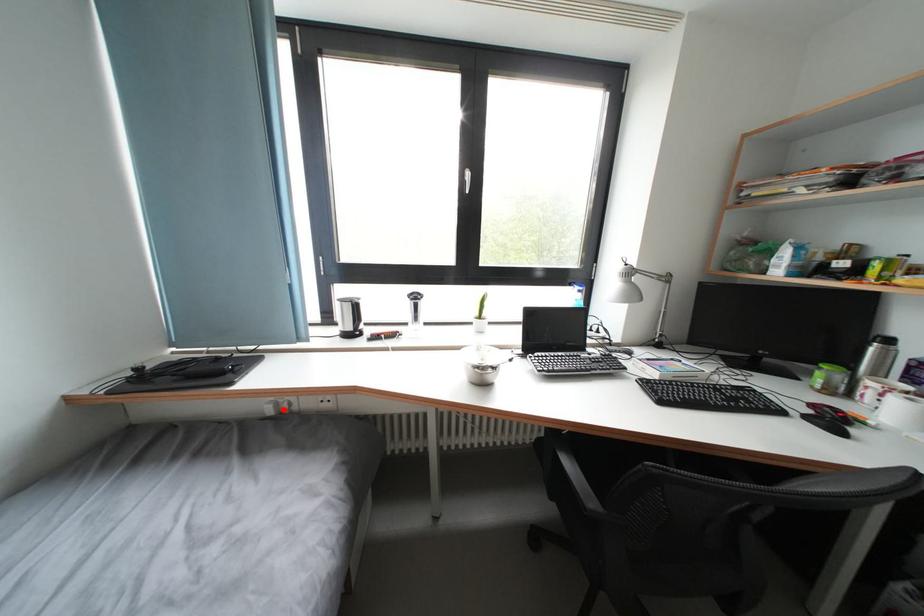
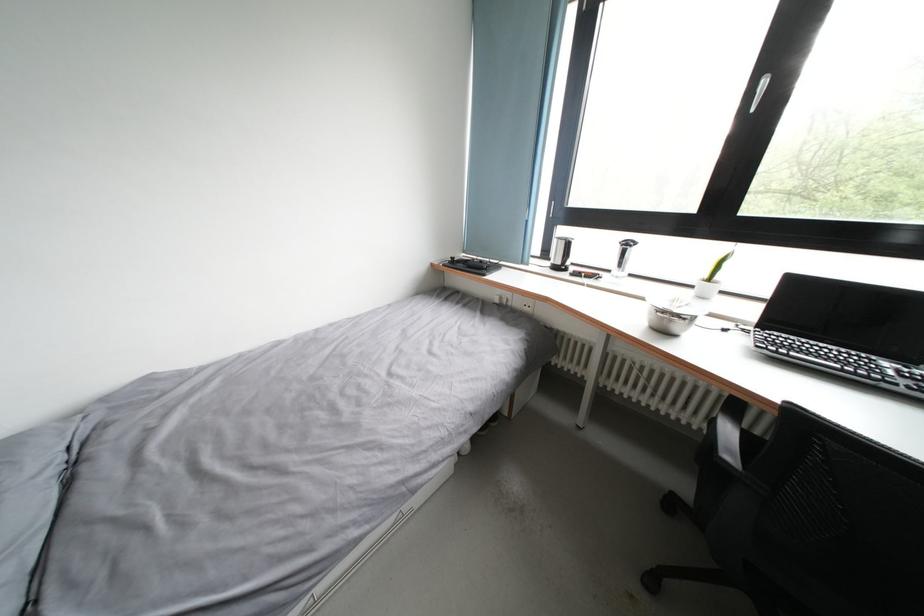
The point at the highlighted location is marked in the first image. Where is the corresponding point in the second image?

(507, 302)